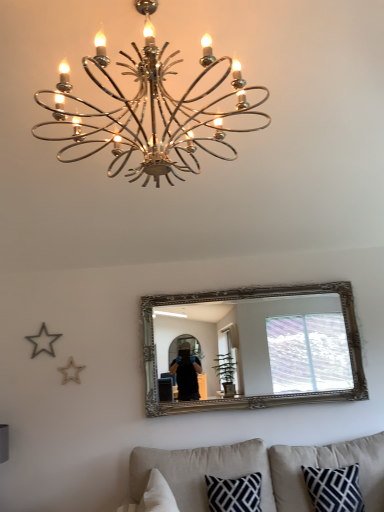
Question: Is chrome/metallic chandelier at upper center to the right of silver/gilded mirror at center from the viewer's perspective?

Choices:
 (A) yes
 (B) no

Answer: (B)

Question: Can you confirm if chrome/metallic chandelier at upper center is taller than silver/gilded mirror at center?

Choices:
 (A) yes
 (B) no

Answer: (B)

Question: From the image's perspective, is chrome/metallic chandelier at upper center above silver/gilded mirror at center?

Choices:
 (A) yes
 (B) no

Answer: (A)

Question: Is the position of chrome/metallic chandelier at upper center less distant than that of silver/gilded mirror at center?

Choices:
 (A) yes
 (B) no

Answer: (A)

Question: Considering the relative sizes of chrome/metallic chandelier at upper center and silver/gilded mirror at center in the image provided, is chrome/metallic chandelier at upper center thinner than silver/gilded mirror at center?

Choices:
 (A) yes
 (B) no

Answer: (B)

Question: From the image's perspective, is chrome/metallic chandelier at upper center located beneath silver/gilded mirror at center?

Choices:
 (A) no
 (B) yes

Answer: (A)

Question: Does beige fabric couch at lower center turn towards silver/gilded mirror at center?

Choices:
 (A) no
 (B) yes

Answer: (A)

Question: Would you consider beige fabric couch at lower center to be distant from silver/gilded mirror at center?

Choices:
 (A) yes
 (B) no

Answer: (B)

Question: Could silver/gilded mirror at center be considered to be inside beige fabric couch at lower center?

Choices:
 (A) yes
 (B) no

Answer: (B)

Question: Is beige fabric couch at lower center oriented away from silver/gilded mirror at center?

Choices:
 (A) no
 (B) yes

Answer: (A)

Question: Can you confirm if beige fabric couch at lower center is smaller than silver/gilded mirror at center?

Choices:
 (A) yes
 (B) no

Answer: (B)

Question: Is beige fabric couch at lower center behind silver/gilded mirror at center?

Choices:
 (A) no
 (B) yes

Answer: (A)

Question: Does beige fabric couch at lower center come behind chrome/metallic chandelier at upper center?

Choices:
 (A) no
 (B) yes

Answer: (B)